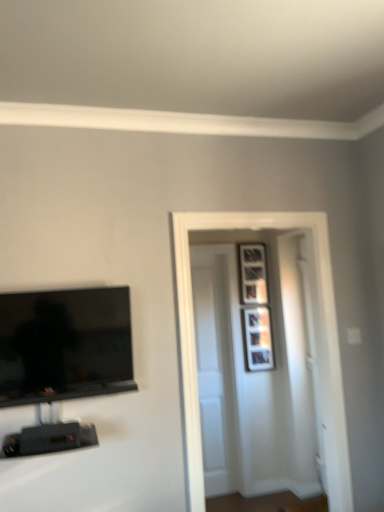
Question: In terms of size, does white glossy door at center, arranged as the 2th door when viewed from the back, appear bigger or smaller than white wooden door at center, marked as the second door in a front-to-back arrangement?

Choices:
 (A) big
 (B) small

Answer: (A)

Question: Is white glossy door at center, arranged as the 2th door when viewed from the back, situated inside white wooden door at center, positioned as the first door in back-to-front order, or outside?

Choices:
 (A) inside
 (B) outside

Answer: (B)

Question: Which of these objects is positioned closest to the matte silver picture frame at upper right, which is counted as the second picture frame, starting from the top?

Choices:
 (A) white wooden door at center, positioned as the first door in back-to-front order
 (B) wooden picture frame at upper right, placed as the first picture frame when sorted from top to bottom
 (C) black glossy tv at left
 (D) white glossy door at center, arranged as the 2th door when viewed from the back

Answer: (B)

Question: Which object is positioned farthest from the black glossy tv at left?

Choices:
 (A) white wooden door at center, marked as the second door in a front-to-back arrangement
 (B) matte silver picture frame at upper right, which is counted as the second picture frame, starting from the top
 (C) white glossy door at center, the first door viewed from the front
 (D) wooden picture frame at upper right, placed as the first picture frame when sorted from top to bottom

Answer: (D)